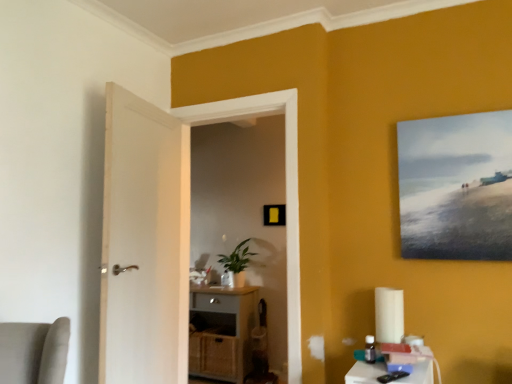
Question: Can we say matte white door at center lies outside white plastic table at lower right?

Choices:
 (A) no
 (B) yes

Answer: (B)

Question: Is matte white door at center shorter than white plastic table at lower right?

Choices:
 (A) yes
 (B) no

Answer: (B)

Question: Is white plastic table at lower right surrounded by matte white door at center?

Choices:
 (A) no
 (B) yes

Answer: (A)

Question: From a real-world perspective, is matte white door at center over white plastic table at lower right?

Choices:
 (A) no
 (B) yes

Answer: (B)

Question: Is matte white door at center oriented away from white plastic table at lower right?

Choices:
 (A) no
 (B) yes

Answer: (A)

Question: Does matte white door at center have a lesser width compared to white plastic table at lower right?

Choices:
 (A) yes
 (B) no

Answer: (A)

Question: From the image's perspective, would you say matte canvas painting at upper right, which is the 2th picture frame from back to front, is shown under matte white door at center?

Choices:
 (A) yes
 (B) no

Answer: (B)

Question: Is matte canvas painting at upper right, which is the 2th picture frame from back to front, bigger than matte white door at center?

Choices:
 (A) yes
 (B) no

Answer: (B)

Question: Considering the relative sizes of matte canvas painting at upper right, placed as the 1th picture frame when sorted from front to back, and matte white door at center in the image provided, is matte canvas painting at upper right, placed as the 1th picture frame when sorted from front to back, smaller than matte white door at center?

Choices:
 (A) yes
 (B) no

Answer: (A)

Question: Can we say matte canvas painting at upper right, the first picture frame when ordered from right to left, lies outside matte white door at center?

Choices:
 (A) yes
 (B) no

Answer: (A)

Question: From a real-world perspective, is matte canvas painting at upper right, placed as the 1th picture frame when sorted from front to back, positioned under matte white door at center based on gravity?

Choices:
 (A) no
 (B) yes

Answer: (A)

Question: Can you confirm if matte canvas painting at upper right, which is the 2th picture frame from back to front, is wider than matte white door at center?

Choices:
 (A) yes
 (B) no

Answer: (B)

Question: Is matte gray cabinet at center far away from green matte plant at center?

Choices:
 (A) yes
 (B) no

Answer: (B)